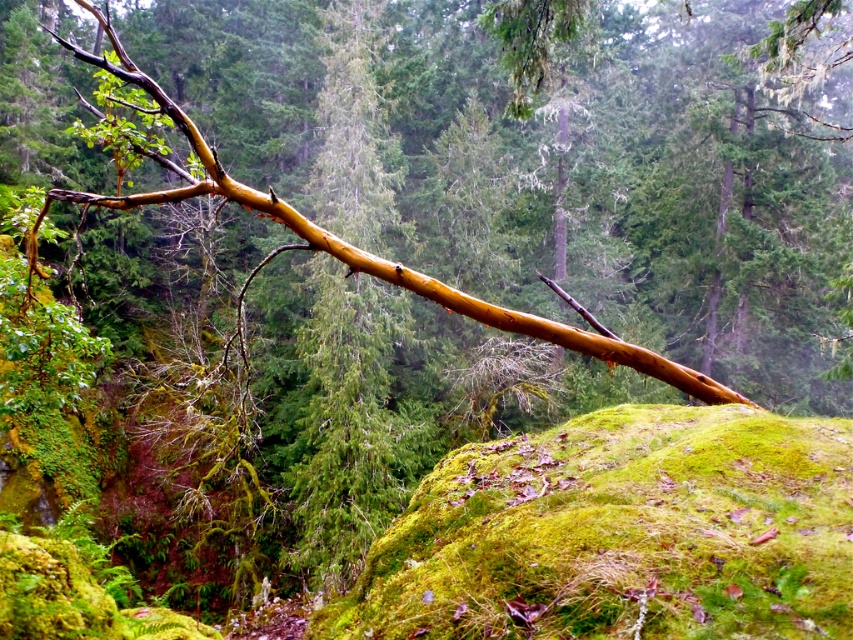
Question: Which point appears closest to the camera in this image?

Choices:
 (A) (482, 588)
 (B) (735, 154)

Answer: (A)

Question: Can you confirm if green mossy rock at center is bigger than glossy brown branch at upper center?

Choices:
 (A) yes
 (B) no

Answer: (B)

Question: Does green mossy rock at center lie in front of glossy brown branch at upper center?

Choices:
 (A) no
 (B) yes

Answer: (B)

Question: Can you confirm if green mossy rock at center is positioned to the right of glossy brown branch at upper center?

Choices:
 (A) no
 (B) yes

Answer: (B)